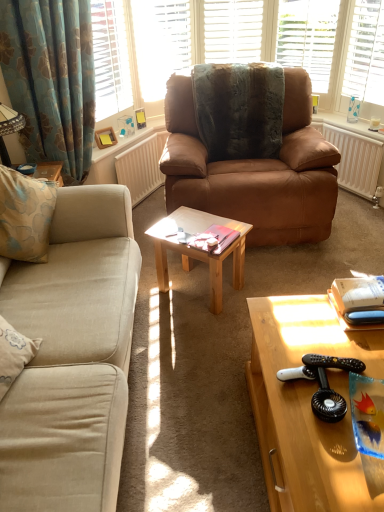
At what (x,y) coordinates should I click in order to perform the action: click on vacant space to the left of matte wooden picture frame at upper left. Please return your answer as a coordinate pair (x, y). This screenshot has height=512, width=384. Looking at the image, I should click on (101, 145).